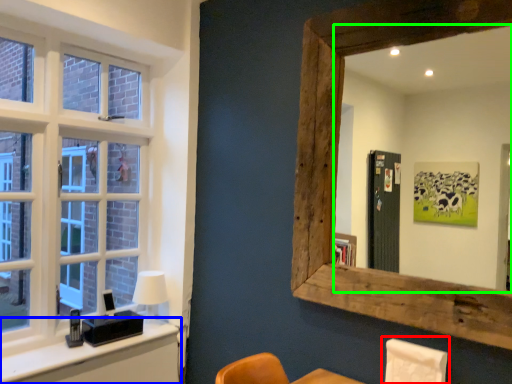
Question: Based on their relative distances, which object is nearer to swivel chair (highlighted by a red box)? Choose from vanity (highlighted by a blue box) and mirror (highlighted by a green box).

Choices:
 (A) vanity
 (B) mirror

Answer: (A)